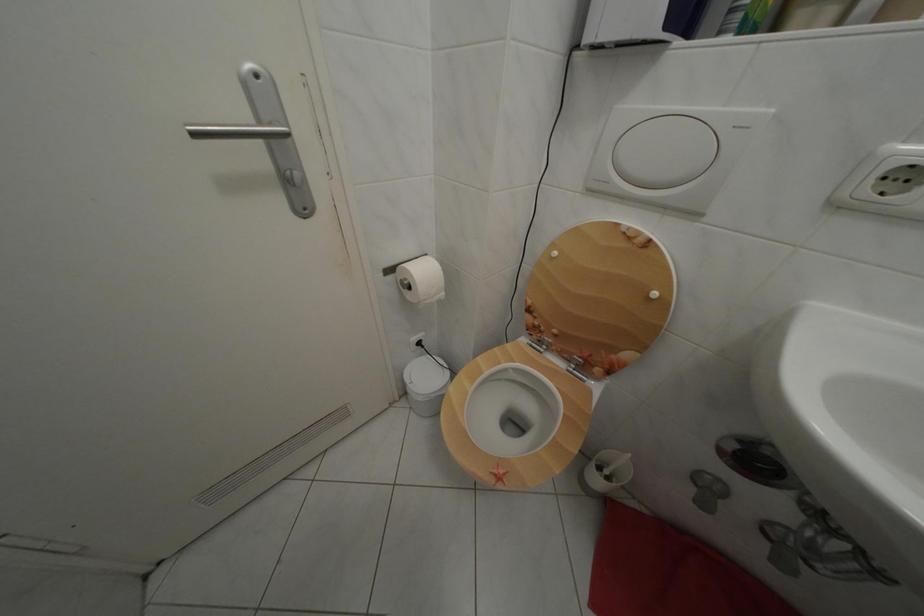
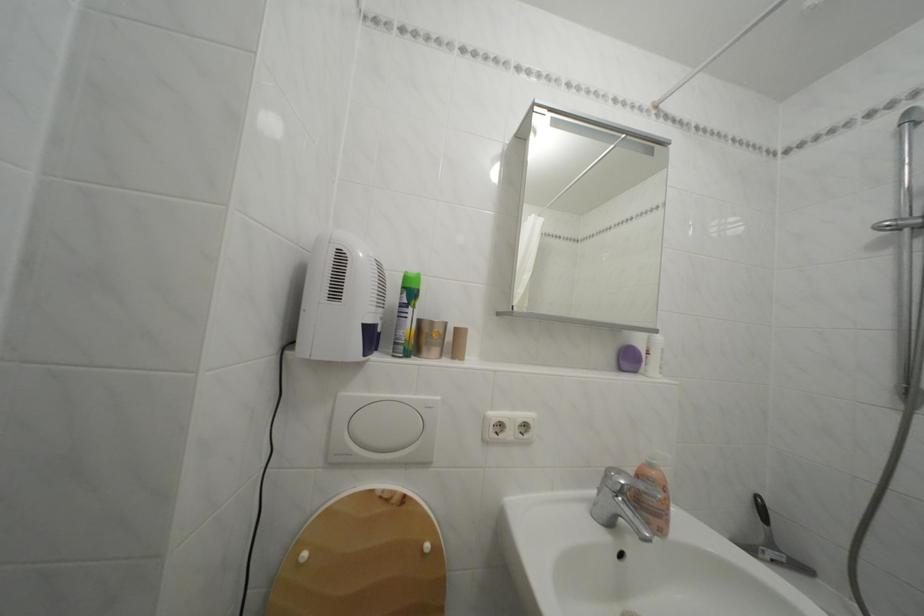
The images are taken continuously from a first-person perspective. In which direction is your viewpoint rotating?

The rotation direction of the camera is right-up.